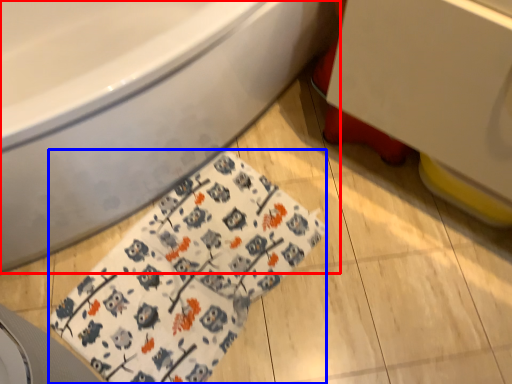
Question: Which object appears closest to the camera in this image, bathtub (highlighted by a red box) or blanket (highlighted by a blue box)?

Choices:
 (A) bathtub
 (B) blanket

Answer: (A)